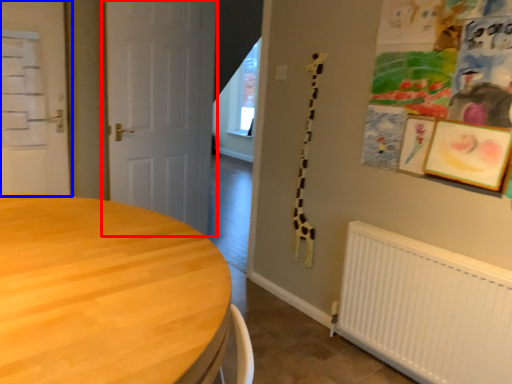
Question: Which object appears closest to the camera in this image, door (highlighted by a red box) or door (highlighted by a blue box)?

Choices:
 (A) door
 (B) door

Answer: (B)